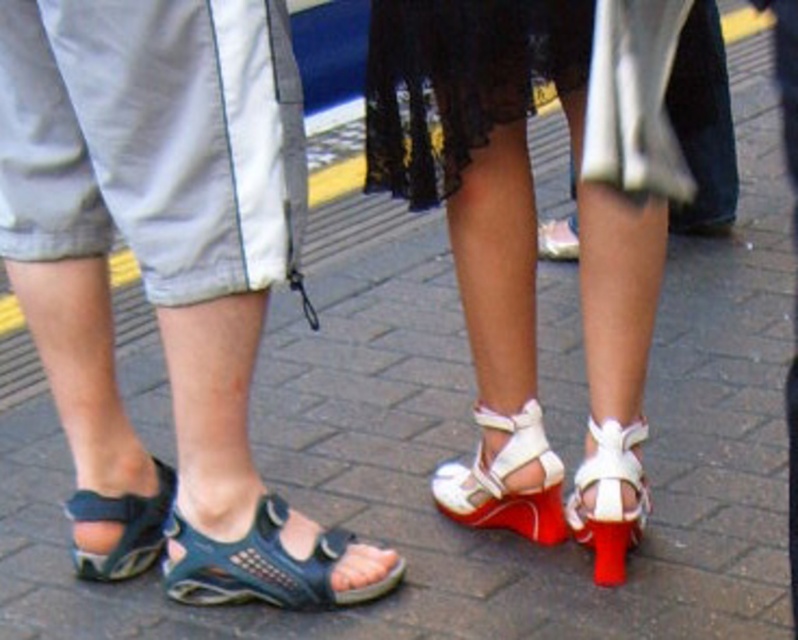
Question: Which point is farther to the camera?

Choices:
 (A) white leather sandal at lower right
 (B) black lace dress at center
 (C) blue fabric sandal at lower left
 (D) white leather sandal at center

Answer: (D)

Question: Observing the image, what is the correct spatial positioning of black mesh sandal at lower left in reference to white leather sandal at lower right?

Choices:
 (A) left
 (B) right

Answer: (A)

Question: Which object is farther from the camera taking this photo?

Choices:
 (A) black lace dress at center
 (B) white leather sandal at center
 (C) white leather sandal at lower right

Answer: (B)

Question: Is white leather sandal at lower right above white leather sandal at center?

Choices:
 (A) no
 (B) yes

Answer: (A)

Question: Is black lace dress at center to the left of white matte sandal at center from the viewer's perspective?

Choices:
 (A) yes
 (B) no

Answer: (A)

Question: Considering the real-world distances, which object is closest to the black lace dress at center?

Choices:
 (A) blue fabric sandal at lower left
 (B) white matte sandal at center
 (C) white leather sandal at lower right

Answer: (B)